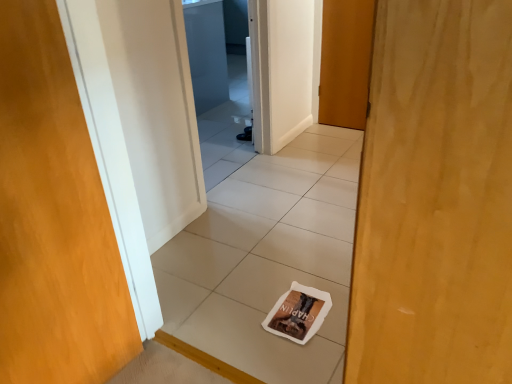
Question: From a real-world perspective, is wooden door at left, which is the first door in bottom-to-top order, on wooden door at center, the second door positioned from the bottom?

Choices:
 (A) no
 (B) yes

Answer: (B)

Question: Is wooden door at left, which is the first door in bottom-to-top order, taller than wooden door at center, placed as the 2th door when sorted from left to right?

Choices:
 (A) yes
 (B) no

Answer: (A)

Question: Can we say wooden door at left, the first door when ordered from left to right, lies outside wooden door at center, which is the 1th door in back-to-front order?

Choices:
 (A) no
 (B) yes

Answer: (B)

Question: Considering the relative positions of wooden door at left, which is the 2th door from top to bottom, and wooden door at center, the 2th door in the front-to-back sequence, in the image provided, is wooden door at left, which is the 2th door from top to bottom, behind wooden door at center, the 2th door in the front-to-back sequence,?

Choices:
 (A) yes
 (B) no

Answer: (B)

Question: Is wooden door at center, the 2th door in the front-to-back sequence, a part of wooden door at left, which is the 2th door from top to bottom?

Choices:
 (A) yes
 (B) no

Answer: (B)

Question: From the image's perspective, is wooden door at center, placed as the 2th door when sorted from left to right, located above or below transparent glass screen door at upper center?

Choices:
 (A) below
 (B) above

Answer: (A)

Question: Considering the positions of wooden door at center, the second door positioned from the bottom, and transparent glass screen door at upper center in the image, is wooden door at center, the second door positioned from the bottom, taller or shorter than transparent glass screen door at upper center?

Choices:
 (A) tall
 (B) short

Answer: (A)

Question: Which is correct: wooden door at center, which is the 1th door from top to bottom, is inside transparent glass screen door at upper center, or outside of it?

Choices:
 (A) inside
 (B) outside

Answer: (B)

Question: Considering the relative positions of wooden door at center, placed as the 2th door when sorted from left to right, and transparent glass screen door at upper center in the image provided, is wooden door at center, placed as the 2th door when sorted from left to right, to the left or to the right of transparent glass screen door at upper center?

Choices:
 (A) right
 (B) left

Answer: (A)

Question: Does point (246, 218) appear closer or farther from the camera than point (62, 135)?

Choices:
 (A) farther
 (B) closer

Answer: (A)

Question: Is white tile at center inside the boundaries of wooden door at left, which is counted as the 2th door, starting from the back, or outside?

Choices:
 (A) outside
 (B) inside

Answer: (A)

Question: From a real-world perspective, relative to wooden door at left, which is the first door in bottom-to-top order, is white tile at center vertically above or below?

Choices:
 (A) above
 (B) below

Answer: (B)

Question: Relative to wooden door at left, which is counted as the 2th door, starting from the back, is white tile at center in front or behind?

Choices:
 (A) front
 (B) behind

Answer: (B)

Question: Is white tile at center inside or outside of wooden door at center, placed as the 2th door when sorted from left to right?

Choices:
 (A) inside
 (B) outside

Answer: (B)

Question: Considering their positions, is white tile at center located in front of or behind wooden door at center, the 2th door in the front-to-back sequence?

Choices:
 (A) front
 (B) behind

Answer: (A)